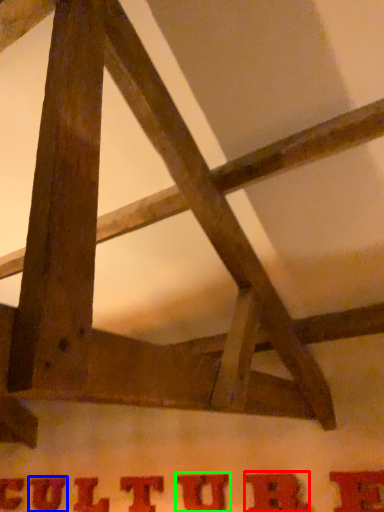
Question: Considering the real-world distances, which object is farthest from letter (highlighted by a red box)? letter (highlighted by a blue box) or letter (highlighted by a green box)?

Choices:
 (A) letter
 (B) letter

Answer: (A)